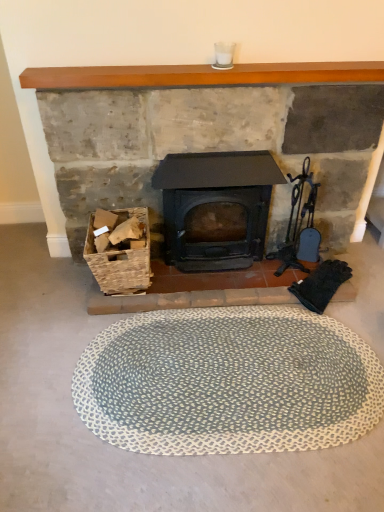
Where is `free spot above matte black stove at center (from a real-world perspective)`? Image resolution: width=384 pixels, height=512 pixels. free spot above matte black stove at center (from a real-world perspective) is located at coordinates point(206,86).